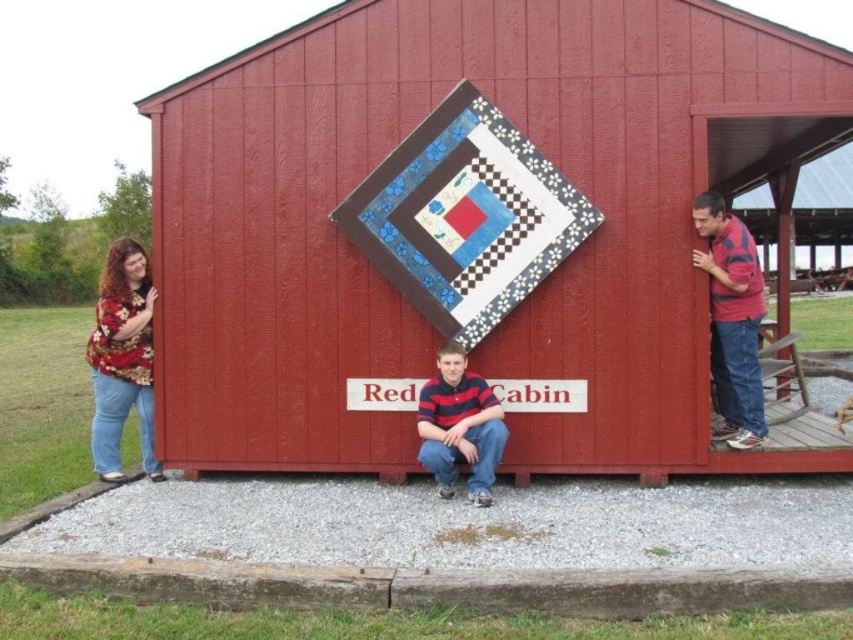
You are standing in front of the smooth wooden barn at center. You want to take a photo of it from a distance of exactly 6 meters. Is your current position suitable?

The smooth wooden barn at center is 5.98 meters away from the camera, which is very close to 6 meters. Therefore, your current position is suitable for taking the photo.

You are planning to hang the quilted fabric quilt at center and the striped cotton shirt at right on a clothesline. The clothesline is 1.8 meters above the ground. Can both items be hung without touching the ground when fully extended?

The quilted fabric quilt at center has a greater height compared to striped cotton shirt at right. Since the clothesline is 1.8 meters high, both items can be hung without touching the ground as long as their combined height does not exceed the clothesline height. However, since the quilt is taller, ensure it is hung properly to avoid dragging.